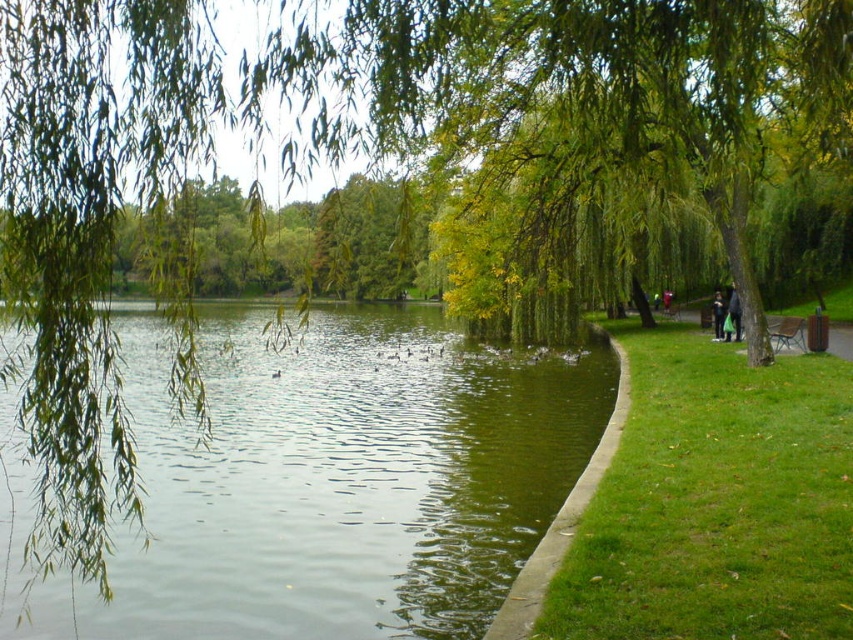
Does green liquid water at center appear over dark blue jeans at right?

Actually, green liquid water at center is below dark blue jeans at right.

Is green liquid water at center to the left of dark blue jeans at right from the viewer's perspective?

Indeed, green liquid water at center is positioned on the left side of dark blue jeans at right.

At what (x,y) coordinates should I click in order to perform the action: click on green liquid water at center. Please return your answer as a coordinate pair (x, y). The height and width of the screenshot is (640, 853). Looking at the image, I should click on (323, 481).

Identify the location of green liquid water at center. (323, 481).

Does point (560, 522) lie behind point (799, 333)?

No, (560, 522) is closer to viewer.

Can you confirm if green concrete path at lower center is positioned above wooden park bench at right?

Actually, green concrete path at lower center is below wooden park bench at right.

Identify the location of green concrete path at lower center. The height and width of the screenshot is (640, 853). (561, 518).

Is green liquid water at center further to camera compared to dark gray fabric jacket at right?

No, green liquid water at center is in front of dark gray fabric jacket at right.

Does green liquid water at center have a greater height compared to dark gray fabric jacket at right?

Indeed, green liquid water at center has a greater height compared to dark gray fabric jacket at right.

Which is behind, point (346, 564) or point (733, 291)?

The point (733, 291) is more distant.

Locate an element on the screen. green liquid water at center is located at coordinates (323, 481).